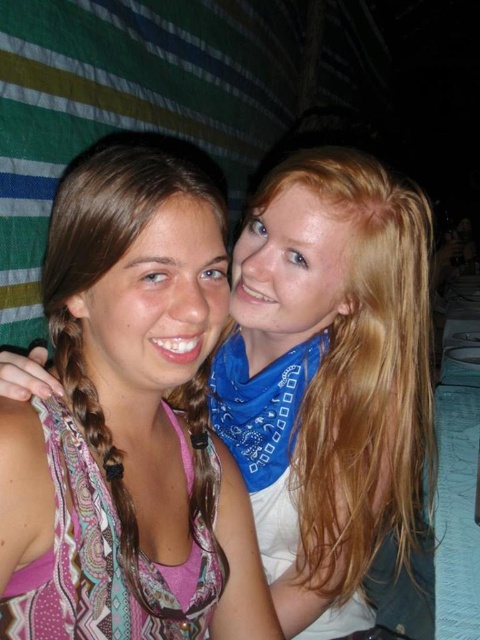
Question: Among these points, which one is farthest from the camera?

Choices:
 (A) (264, 252)
 (B) (67, 209)

Answer: (A)

Question: Is multicolored scarf at center to the right of paisley fabric scarf at left from the viewer's perspective?

Choices:
 (A) no
 (B) yes

Answer: (B)

Question: Can you confirm if multicolored scarf at center is positioned above paisley fabric scarf at left?

Choices:
 (A) yes
 (B) no

Answer: (B)

Question: In this image, where is multicolored scarf at center located relative to paisley fabric scarf at left?

Choices:
 (A) right
 (B) left

Answer: (A)